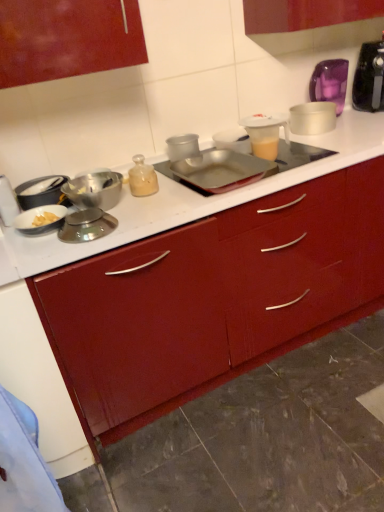
Where is `free space above white matte bowl at left, which is the third kitchen appliance in left-to-right order (from a real-world perspective)`? The width and height of the screenshot is (384, 512). free space above white matte bowl at left, which is the third kitchen appliance in left-to-right order (from a real-world perspective) is located at coordinates (40, 211).